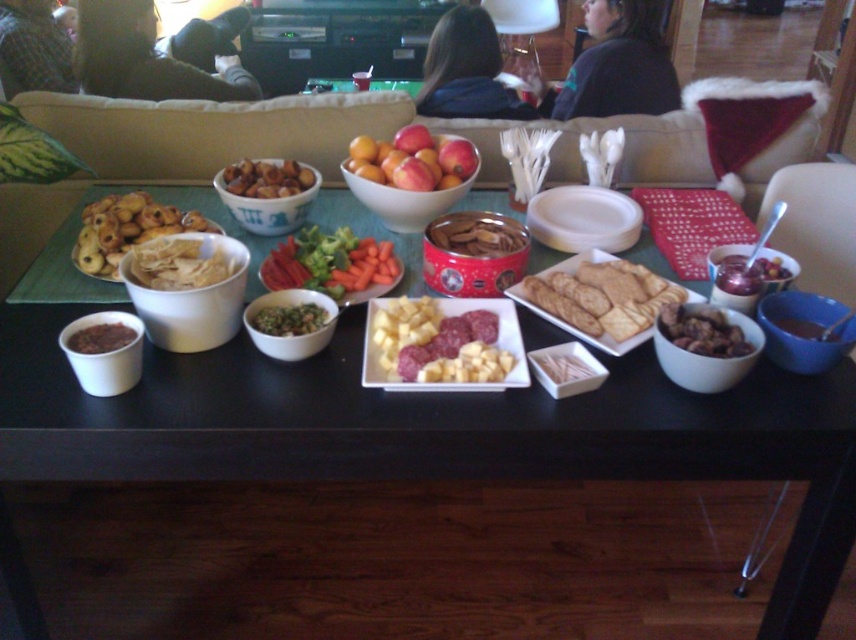
Question: Which object is positioned closest to the white paper napkins at center?

Choices:
 (A) white paper chips at center
 (B) brown matte dried fruits at center

Answer: (B)

Question: Which is farther from the green leafy vegetables at center?

Choices:
 (A) white matte plate at center
 (B) brown matte bowl at center
 (C) white paper chips at center
 (D) yellowish matte cheese at center

Answer: (A)

Question: Does golden brown cracker at center appear under brown matte dried fruits at center?

Choices:
 (A) yes
 (B) no

Answer: (B)

Question: Is shiny red apples at center in front of brown matte bowl at center?

Choices:
 (A) no
 (B) yes

Answer: (A)

Question: Is matte brown cookies at left below brown matte cookies at center?

Choices:
 (A) yes
 (B) no

Answer: (B)

Question: Among these objects, which one is farthest from the camera?

Choices:
 (A) brown matte dried fruits at center
 (B) green leafy vegetables at center
 (C) golden brown cracker at center

Answer: (B)